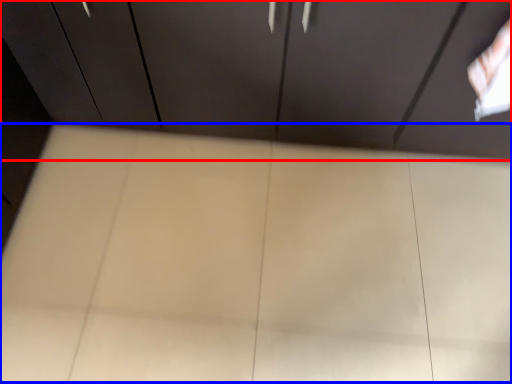
Question: Which point is closer to the camera, cupboard (highlighted by a red box) or plywood (highlighted by a blue box)?

Choices:
 (A) cupboard
 (B) plywood

Answer: (A)